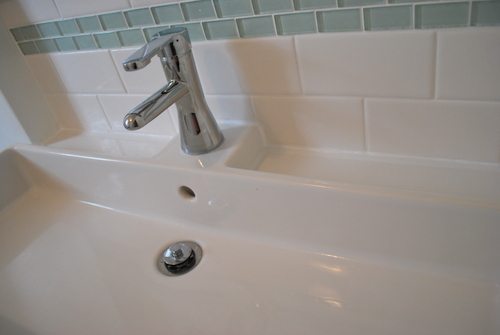
Identify the location of faucet handle. The height and width of the screenshot is (335, 500). (127, 72), (154, 53), (150, 41).